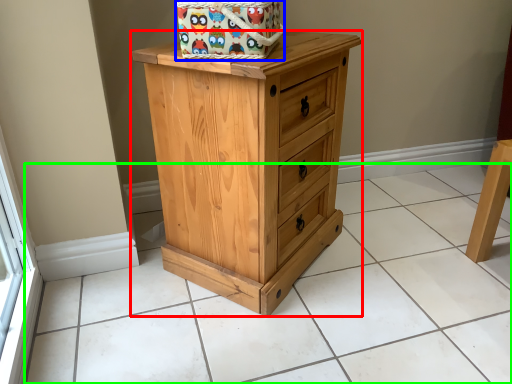
Question: Which is farther away from chest of drawers (highlighted by a red box)? gift basket (highlighted by a blue box) or tile (highlighted by a green box)?

Choices:
 (A) gift basket
 (B) tile

Answer: (B)